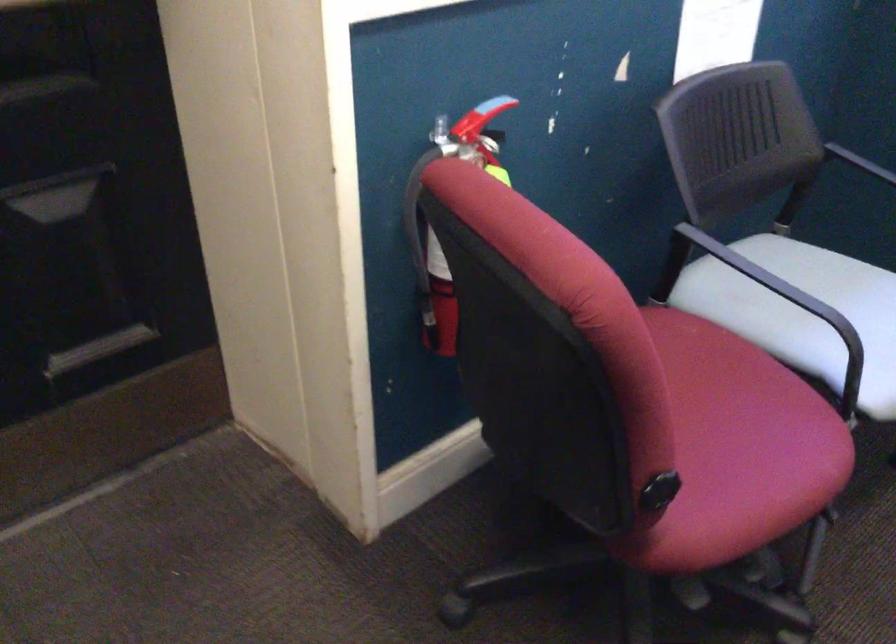
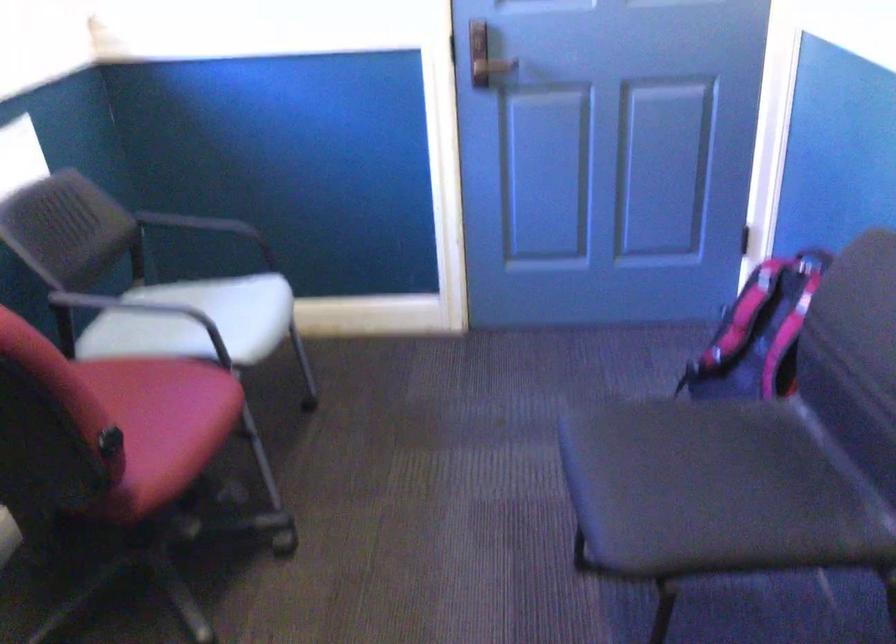
Where in the second image is the point corresponding to pixel 713 418 from the first image?

(149, 402)